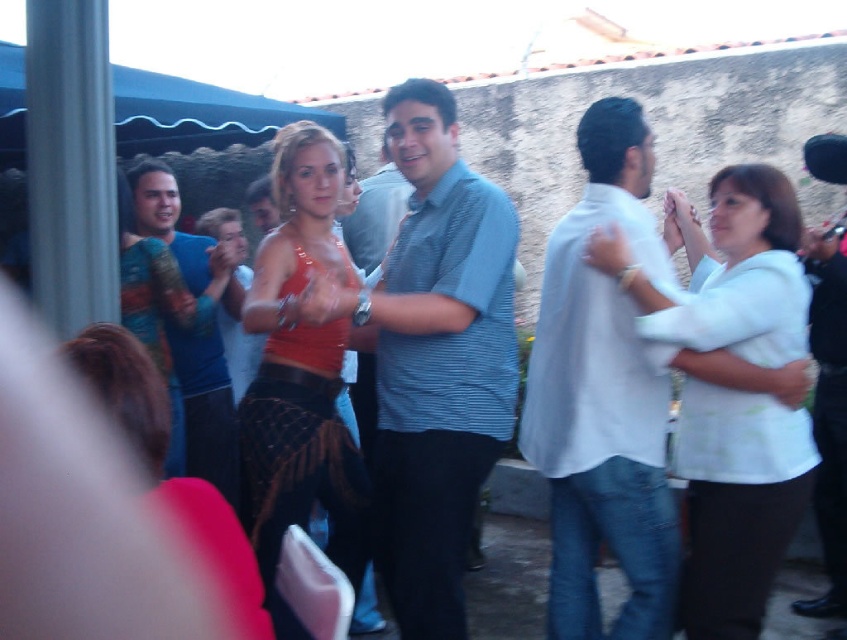
You are at the party and want to give a gift to the taller person between the blue striped shirt at center and the matte orange tank top at center. Which one should you approach?

The blue striped shirt at center is taller than the matte orange tank top at center, so you should approach the blue striped shirt at center.

You are standing at the viewer position in the scene. There is a point at coordinates point (319, 296). Can you reach this point without moving your feet?

The point at (319, 296) is 2.41 meters away from you, so yes, you can reach it without moving your feet since it is within arm reach.